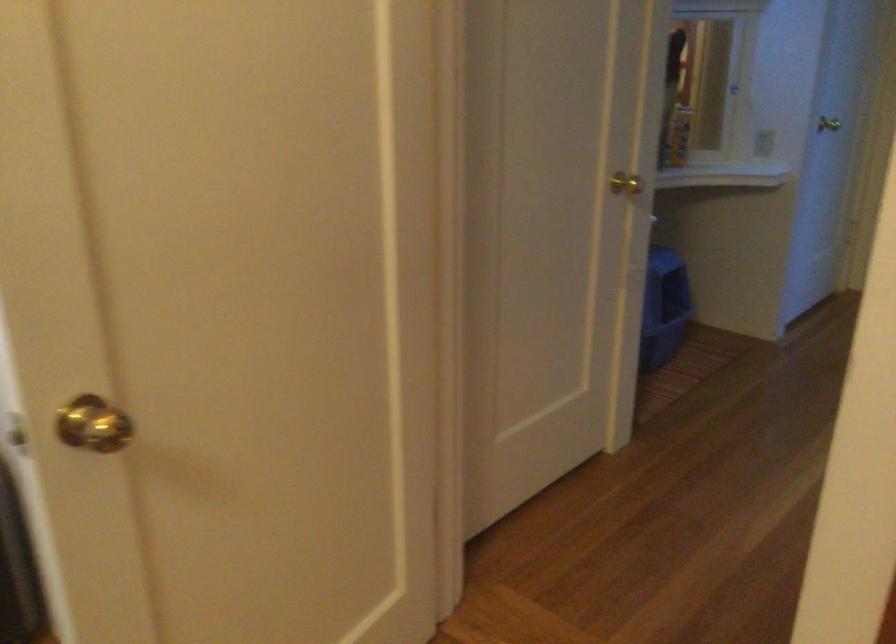
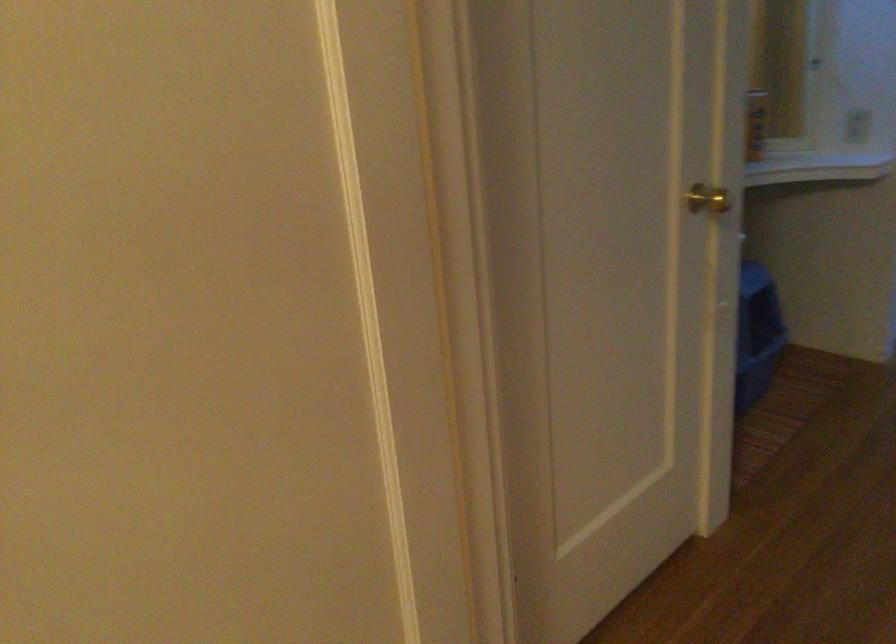
Question: What movement of the cameraman would produce the second image?

Choices:
 (A) Left
 (B) Right
 (C) Forward
 (D) Backward

Answer: (C)